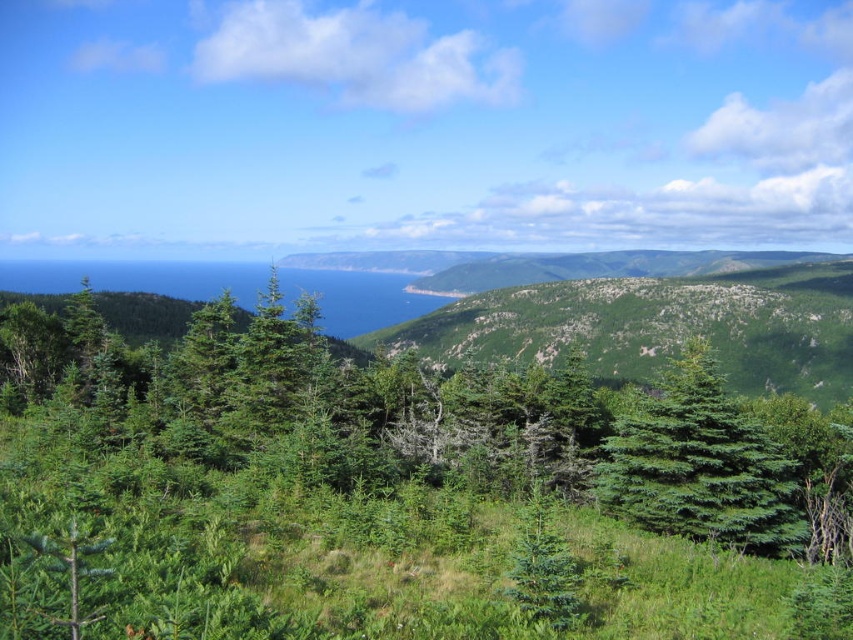
You are a hiker standing at the edge of the grassy area in the midground. You notice two trees in the scene, the green matte tree at center and the green matte evergreen tree at center. Which one is positioned higher up in the image?

The green matte tree at center is positioned higher up in the image than the green matte evergreen tree at center, as it is located above it.

You are standing at the point marked as point (x=701, y=465) in the image. What object are you directly at?

You are directly at the green matte tree at center.

You are a hiker standing at the edge of the grassy area in the midground. You notice two trees in the center of the image. One is labeled as the green matte tree at center and the other as the green matte evergreen tree at center. Which of these two trees has a wider trunk?

The green matte tree at center has a wider trunk than the green matte evergreen tree at center according to the description provided.